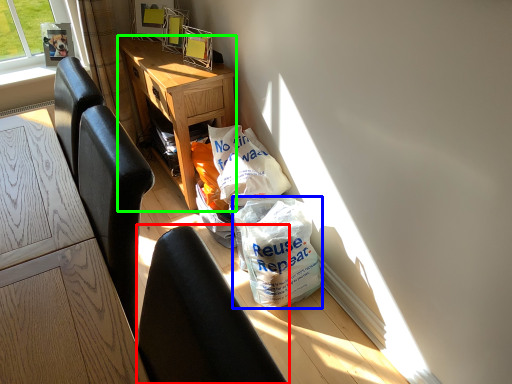
Question: Which object is the closest to the chair (highlighted by a red box)? Choose among these: plastic bag (highlighted by a blue box) or desk (highlighted by a green box).

Choices:
 (A) plastic bag
 (B) desk

Answer: (A)